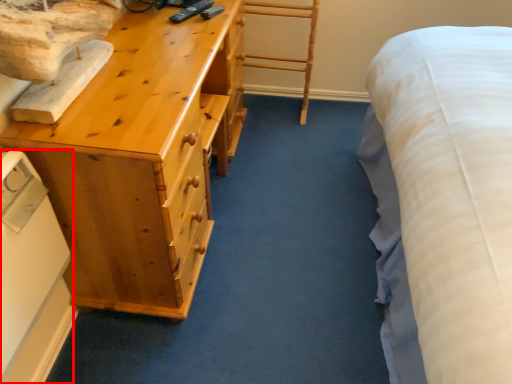
Question: From the image's perspective, what is the correct spatial relationship of appliance (annotated by the red box) in relation to chest of drawers?

Choices:
 (A) above
 (B) below

Answer: (B)